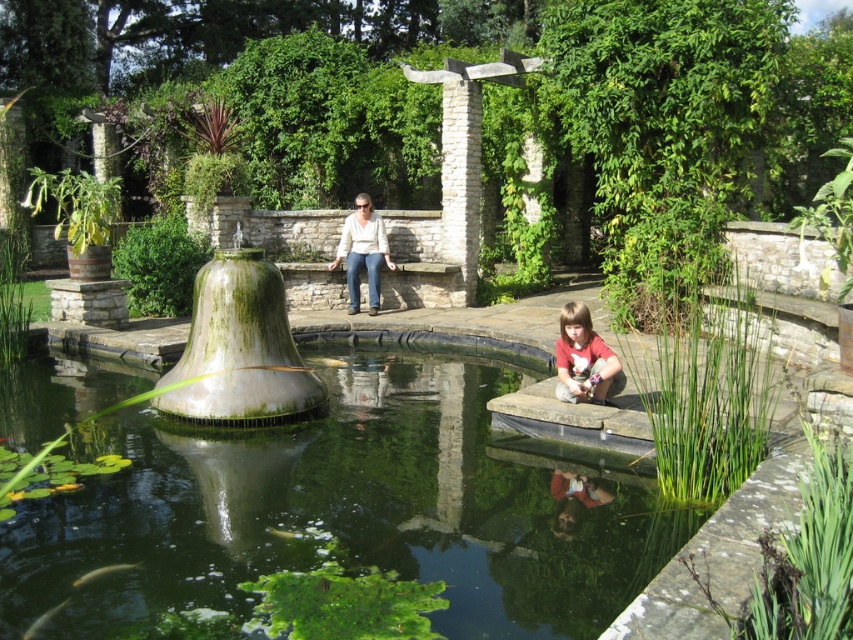
The image size is (853, 640). What do you see at coordinates (241, 349) in the screenshot?
I see `green mossy stone bell at center-left` at bounding box center [241, 349].

Between green mossy stone bell at center-left and translucent green fish at lower center, which one has less height?

With less height is translucent green fish at lower center.

Is point (241, 310) farther from viewer compared to point (103, 570)?

Yes.

Locate an element on the screen. Image resolution: width=853 pixels, height=640 pixels. green mossy stone bell at center-left is located at coordinates (241, 349).

In the scene shown: Is light beige sweater at center to the left of shiny silver fish at lower left from the viewer's perspective?

In fact, light beige sweater at center is to the right of shiny silver fish at lower left.

Locate an element on the screen. light beige sweater at center is located at coordinates (363, 252).

Between point (364, 204) and point (33, 628), which one is positioned in front?

Point (33, 628)

Image resolution: width=853 pixels, height=640 pixels. Find the location of `light beige sweater at center`. light beige sweater at center is located at coordinates (363, 252).

Can you confirm if green mossy stone bell at center-left is smaller than matte red shirt at lower right?

No, green mossy stone bell at center-left is not smaller than matte red shirt at lower right.

Is point (241, 269) closer to camera compared to point (556, 376)?

Yes, point (241, 269) is closer to viewer.

Identify the location of green mossy stone bell at center-left. Image resolution: width=853 pixels, height=640 pixels. (241, 349).